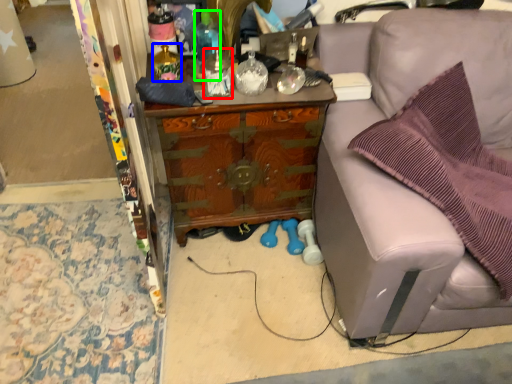
Question: Which object is the farthest from bottle (highlighted by a red box)? Choose among these: bottle (highlighted by a blue box) or bottle (highlighted by a green box).

Choices:
 (A) bottle
 (B) bottle

Answer: (A)